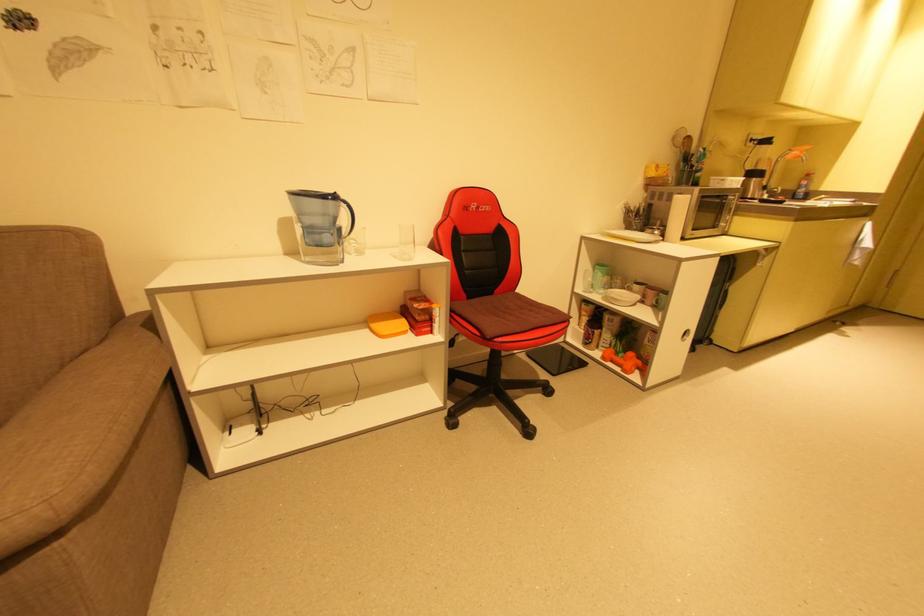
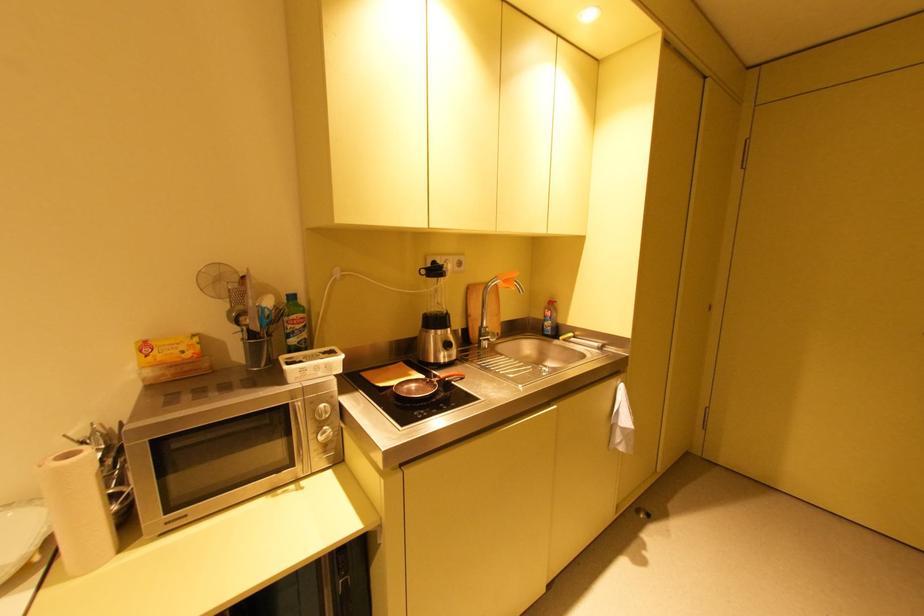
Where in the second image is the point corresponding to point 706,167 from the first image?

(296, 326)